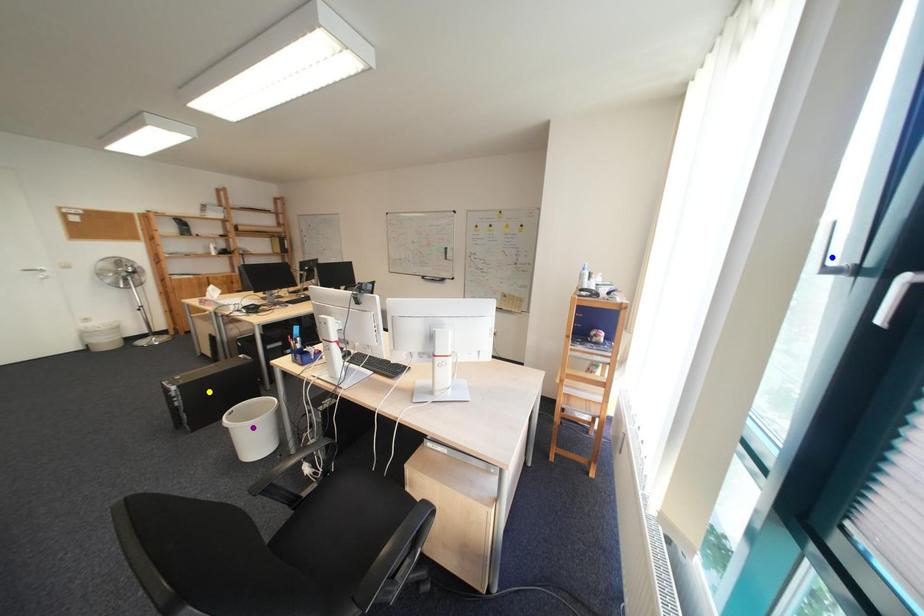
Order these from nearest to farthest:
1. yellow point
2. blue point
3. purple point

blue point
purple point
yellow point